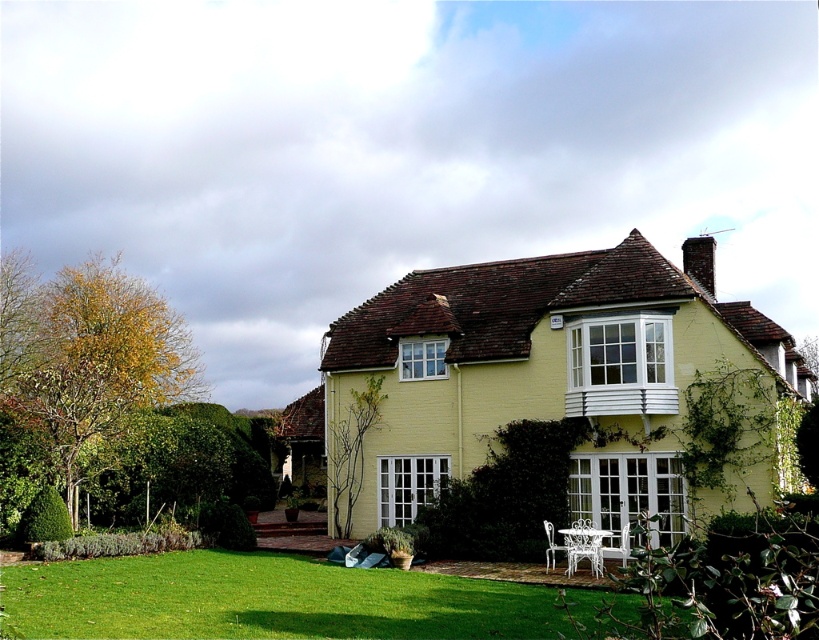
Question: Which object appears closest to the camera in this image?

Choices:
 (A) green grass at lower center
 (B) green leafy hedge at center

Answer: (A)

Question: Does green grass at lower center appear over green leafy hedge at center?

Choices:
 (A) no
 (B) yes

Answer: (B)

Question: Does green grass at lower center have a smaller size compared to green leafy hedge at center?

Choices:
 (A) no
 (B) yes

Answer: (A)

Question: Which of the following is the closest to the observer?

Choices:
 (A) (544, 436)
 (B) (148, 612)

Answer: (B)

Question: From the image, what is the correct spatial relationship of green grass at lower center in relation to green leafy hedge at center?

Choices:
 (A) right
 (B) left

Answer: (B)